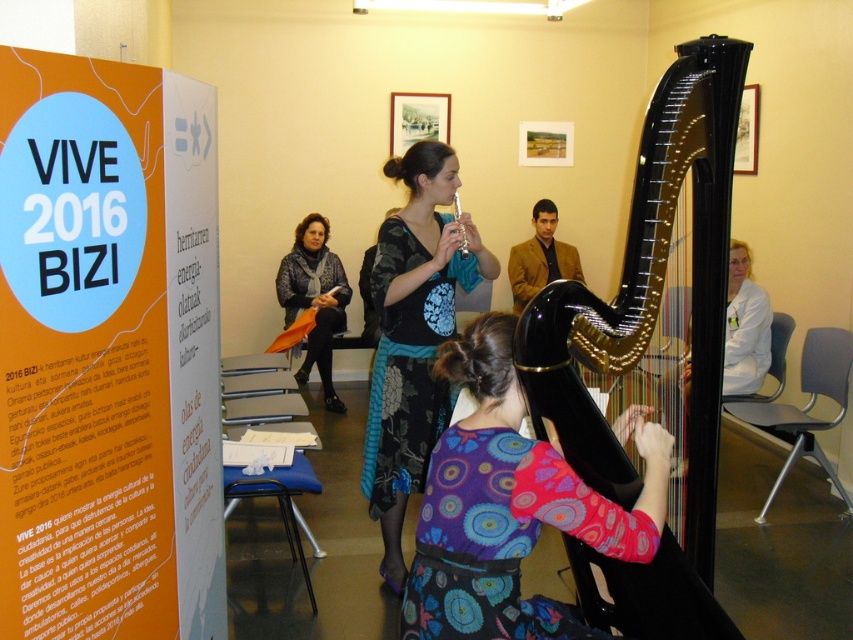
Who is taller, multicolored fabric dress at center or knitted gray scarf at center?

knitted gray scarf at center

Who is positioned more to the left, multicolored fabric dress at center or knitted gray scarf at center?

From the viewer's perspective, knitted gray scarf at center appears more on the left side.

Who is more distant from viewer, [608,541] or [306,225]?

Point [306,225]

Identify the location of multicolored fabric dress at center. Image resolution: width=853 pixels, height=640 pixels. (512, 506).

Does multicolored fabric dress at center have a lesser width compared to matte silver flute at center?

No, multicolored fabric dress at center is not thinner than matte silver flute at center.

Between multicolored fabric dress at center and matte silver flute at center, which one is positioned higher?

matte silver flute at center

This screenshot has width=853, height=640. Find the location of `multicolored fabric dress at center`. multicolored fabric dress at center is located at coordinates (512, 506).

Is point (686, 154) farther from camera compared to point (474, 522)?

Yes, point (686, 154) is farther from viewer.

From the picture: Is glossy black harp at center below multicolored fabric dress at center?

No.

Locate an element on the screen. Image resolution: width=853 pixels, height=640 pixels. glossy black harp at center is located at coordinates (653, 349).